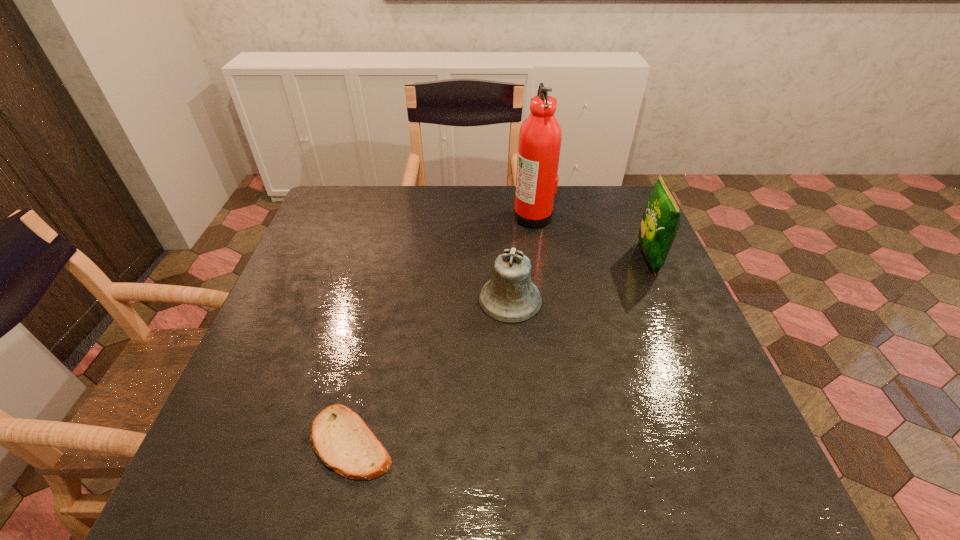
Where is `unoccupied position between the rightmost object and the fire extinguisher`? Image resolution: width=960 pixels, height=540 pixels. unoccupied position between the rightmost object and the fire extinguisher is located at coordinates (590, 237).

In order to click on vacant space in between the second farthest object and the third tallest object in this screenshot , I will do `click(579, 279)`.

Where is `free space between the pita bread and the fire extinguisher`? This screenshot has height=540, width=960. free space between the pita bread and the fire extinguisher is located at coordinates (442, 329).

The width and height of the screenshot is (960, 540). What are the coordinates of `vacant area that lies between the crisp (potato chip) and the shortest object` in the screenshot? It's located at (500, 350).

You are a GUI agent. You are given a task and a screenshot of the screen. Output one action in this format:
    pyautogui.click(x=<x>, y=<y>)
    Task: Click on the free space between the tallest object and the nearest object
    
    Given the screenshot: What is the action you would take?
    pyautogui.click(x=442, y=329)

The height and width of the screenshot is (540, 960). I want to click on object that is the second closest one to the third nearest object, so click(x=510, y=297).

Identify which object is the third closest to the third farthest object. Please provide its 2D coordinates. Your answer should be formatted as a tuple, i.e. [(x, y)], where the tuple contains the x and y coordinates of a point satisfying the conditions above.

[(660, 223)]

Where is `vacant space that satisfies the following two spatial constraints: 1. on the label side of the farthest object; 2. on the front side of the bell`? vacant space that satisfies the following two spatial constraints: 1. on the label side of the farthest object; 2. on the front side of the bell is located at coordinates (545, 299).

This screenshot has width=960, height=540. In order to click on free point that satisfies the following two spatial constraints: 1. on the front-facing side of the second tallest object; 2. on the front side of the nearest object in this screenshot , I will do `click(727, 442)`.